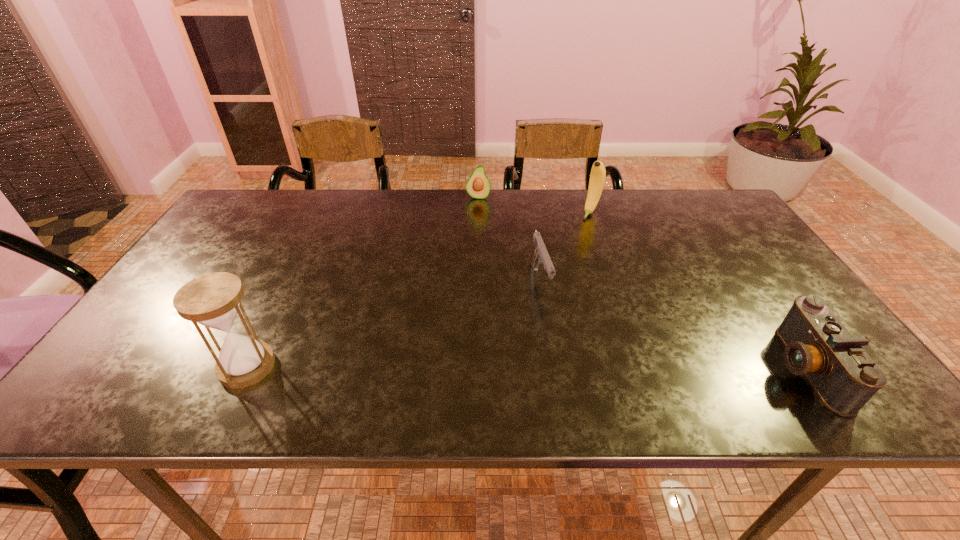
Locate an element on the screen. free space located 0.060m on the cut side of the fourth object from right to left is located at coordinates (476, 211).

Identify the location of free space located on the cut side of the fourth object from right to left. The width and height of the screenshot is (960, 540). (468, 279).

The width and height of the screenshot is (960, 540). What are the coordinates of `banana at the far edge` in the screenshot? It's located at (598, 173).

Where is `avocado that is at the far edge`? The width and height of the screenshot is (960, 540). avocado that is at the far edge is located at coordinates (478, 185).

Locate an element on the screen. This screenshot has width=960, height=540. hourglass situated at the near edge is located at coordinates (213, 300).

This screenshot has height=540, width=960. What are the coordinates of `camera at the near edge` in the screenshot? It's located at (817, 345).

Find the location of a particular element. object that is at the right edge is located at coordinates (817, 345).

Where is `object present at the near right corner`? object present at the near right corner is located at coordinates tap(817, 345).

Image resolution: width=960 pixels, height=540 pixels. In the image, there is a desktop. What are the coordinates of `vacant space at the far edge` in the screenshot? It's located at (404, 217).

This screenshot has width=960, height=540. In the image, there is a desktop. What are the coordinates of `free region at the near edge` in the screenshot? It's located at (216, 353).